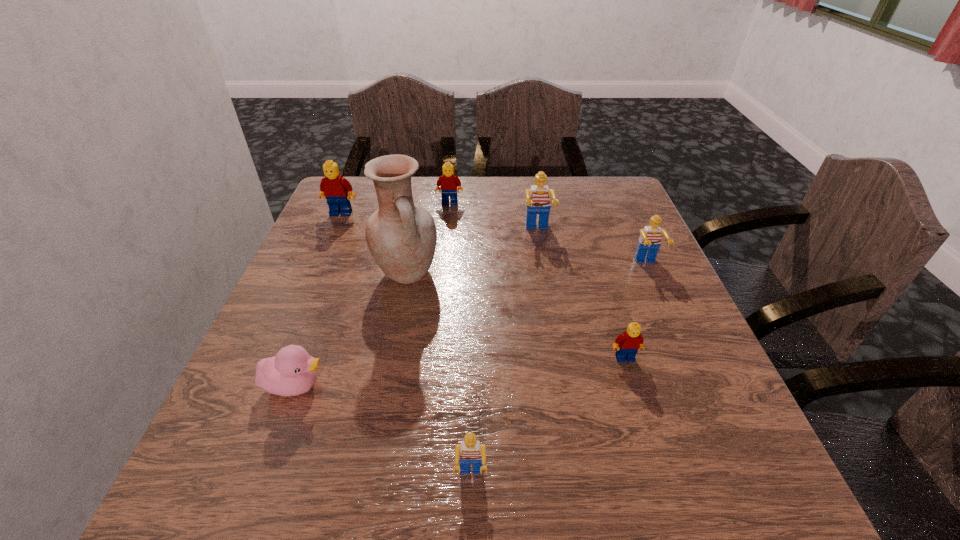
What are the coordinates of `empty space that is in between the second smallest blue Lego and the leftmost yellow Lego` in the screenshot? It's located at (493, 239).

Image resolution: width=960 pixels, height=540 pixels. What are the coordinates of `object that is the fifth closest to the second object from right to left` in the screenshot? It's located at (292, 371).

Find the location of `object identified as the closest to the leftmost blue Lego`. object identified as the closest to the leftmost blue Lego is located at coordinates (292, 371).

Select which Lego is the closest to the nearest Lego. Please provide its 2D coordinates. Your answer should be formatted as a tuple, i.e. [(x, y)], where the tuple contains the x and y coordinates of a point satisfying the conditions above.

[(627, 344)]

Point out which Lego is positioned as the second nearest to the second farthest object. Please provide its 2D coordinates. Your answer should be formatted as a tuple, i.e. [(x, y)], where the tuple contains the x and y coordinates of a point satisfying the conditions above.

[(538, 201)]

Image resolution: width=960 pixels, height=540 pixels. Identify the location of blue Lego that is the closest to the pink duckling. (470, 451).

Select which blue Lego is the second closest to the tallest object. Please provide its 2D coordinates. Your answer should be formatted as a tuple, i.e. [(x, y)], where the tuple contains the x and y coordinates of a point satisfying the conditions above.

[(470, 451)]

Select which yellow Lego appears as the second closest to the rightmost yellow Lego. Please provide its 2D coordinates. Your answer should be formatted as a tuple, i.e. [(x, y)], where the tuple contains the x and y coordinates of a point satisfying the conditions above.

[(334, 188)]

The image size is (960, 540). Find the location of `yellow Lego that stands as the second closest to the smallest blue Lego`. yellow Lego that stands as the second closest to the smallest blue Lego is located at coordinates (448, 181).